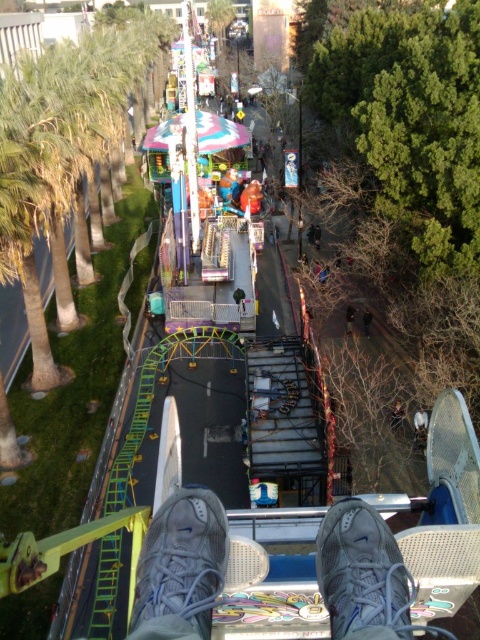
Question: Which of the following is the farthest from the observer?

Choices:
 (A) (197, 556)
 (B) (351, 324)

Answer: (B)

Question: Can you confirm if gray fabric shoe at lower center is thinner than dark blue jeans at center?

Choices:
 (A) no
 (B) yes

Answer: (A)

Question: Is gray fabric shoe at lower center bigger than dark blue jeans at center?

Choices:
 (A) no
 (B) yes

Answer: (B)

Question: Which point is closer to the camera?

Choices:
 (A) (362, 524)
 (B) (368, 332)
 (C) (348, 310)
 (D) (173, 612)

Answer: (D)

Question: Does white mesh shoe at lower center appear on the right side of dark brown leather jacket at center?

Choices:
 (A) yes
 (B) no

Answer: (B)

Question: Which of the following is the closest to the observer?

Choices:
 (A) dark blue jeans at center
 (B) white mesh shoe at lower center
 (C) gray fabric shoe at lower center

Answer: (C)